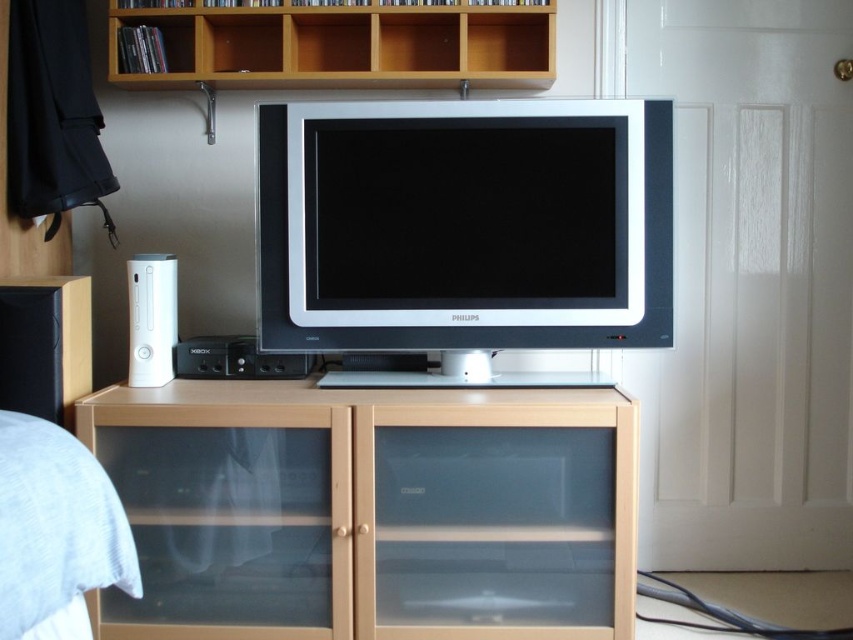
You are setting up a new sound system and need to place the black matte speaker at left and the white glossy xbox at left on a shelf that can only hold items up to 30 cm in width. According to the description, can both items fit side by side on the shelf?

The black matte speaker at left might be wider than the white glossy xbox at left, so their combined width could exceed the 30 cm limit. It is uncertain if they will fit without knowing the exact dimensions.

You are setting up a new speaker system and need to place the black matte speaker at left behind the white glossy xbox at left. Can you do this without moving the xbox?

The black matte speaker at left is currently in front of the white glossy xbox at left, so you can move it behind the xbox without needing to move the xbox itself.

You are setting up a new speaker and need to know which object has more horizontal space. Based on the scene, which object is wider between the light brown wood cabinet at center and the white glossy xbox at left?

The light brown wood cabinet at center is wider than the white glossy xbox at left.